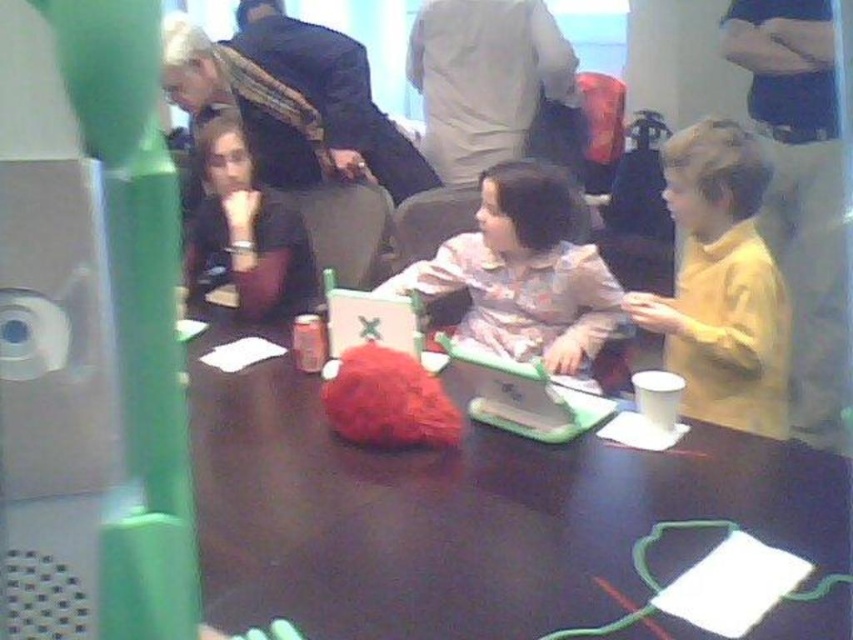
Question: Considering the real-world distances, which object is farthest from the fluffy pink sweater at center?

Choices:
 (A) green plastic laptop at center
 (B) matte black shirt at left

Answer: (B)

Question: Among these points, which one is farthest from the camera?

Choices:
 (A) (593, 467)
 (B) (585, 364)

Answer: (B)

Question: In this image, where is shiny brown table at center located relative to yellow matte shirt at right?

Choices:
 (A) above
 (B) below

Answer: (B)

Question: Does fluffy pink sweater at center appear over matte black shirt at left?

Choices:
 (A) yes
 (B) no

Answer: (B)

Question: Is shiny brown table at center wider than white plastic laptop at center?

Choices:
 (A) yes
 (B) no

Answer: (A)

Question: Which object is farther from the camera taking this photo?

Choices:
 (A) shiny brown table at center
 (B) yellow matte shirt at right

Answer: (B)